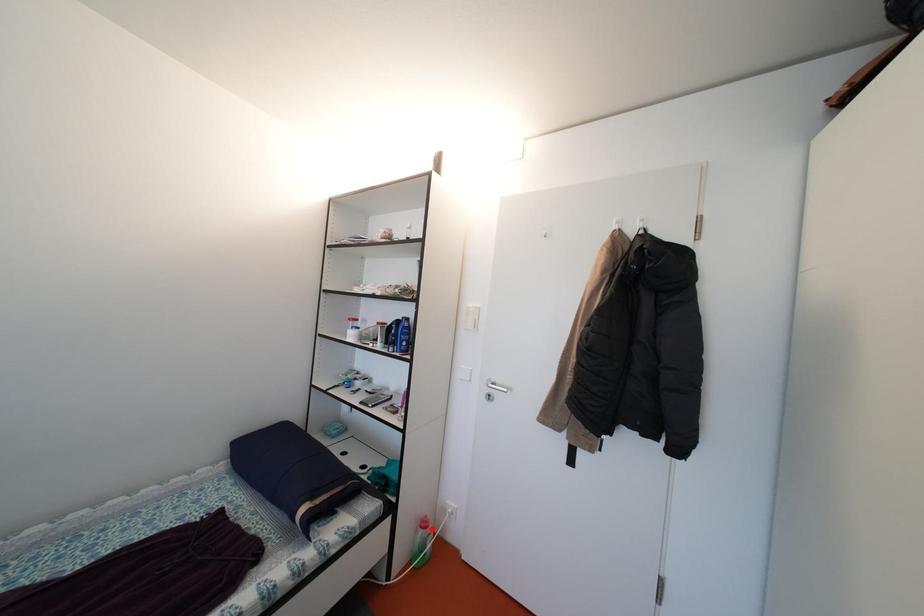
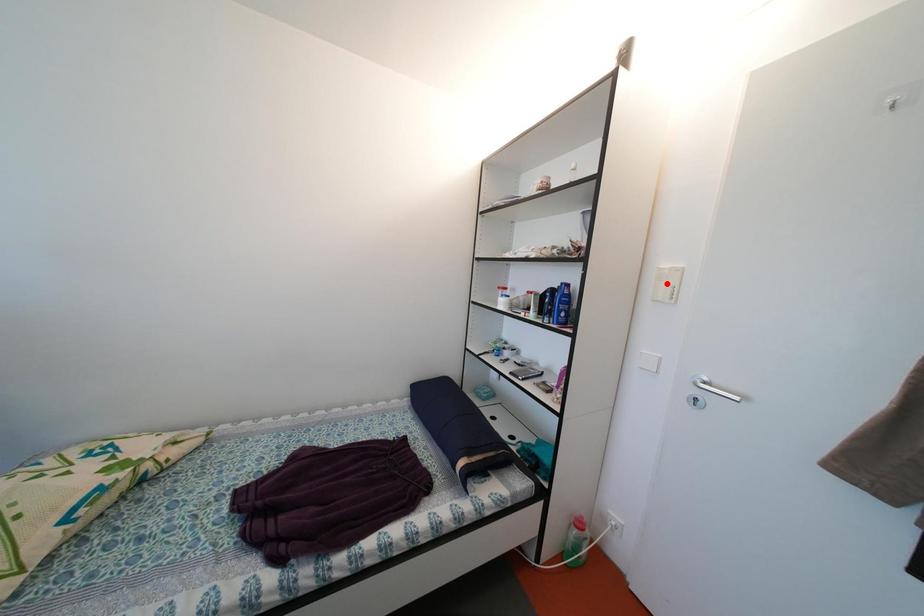
I am providing you with two images of the same scene from different viewpoints. A red point is marked on the first image and another point is marked on the second image. Do the highlighted points in image1 and image2 indicate the same real-world spot?

No